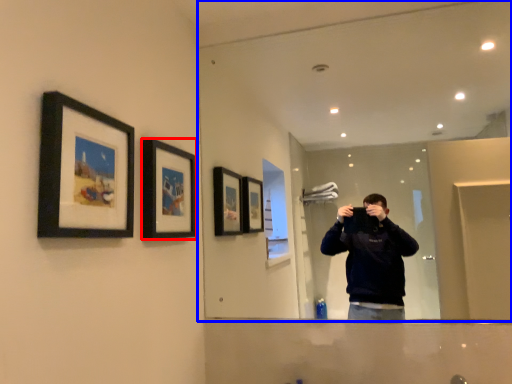
Question: Which object appears closest to the camera in this image, picture frame (highlighted by a red box) or mirror (highlighted by a blue box)?

Choices:
 (A) picture frame
 (B) mirror

Answer: (A)